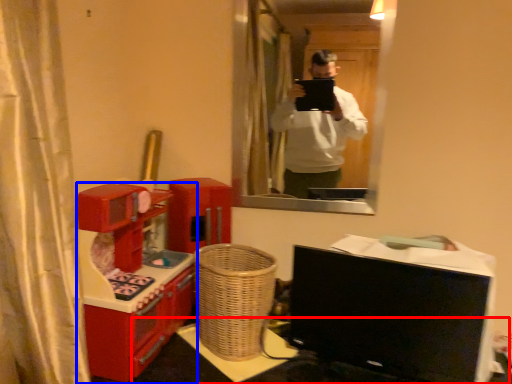
Question: Which point is closer to the camera, table (highlighted by a red box) or furniture (highlighted by a blue box)?

Choices:
 (A) table
 (B) furniture

Answer: (B)